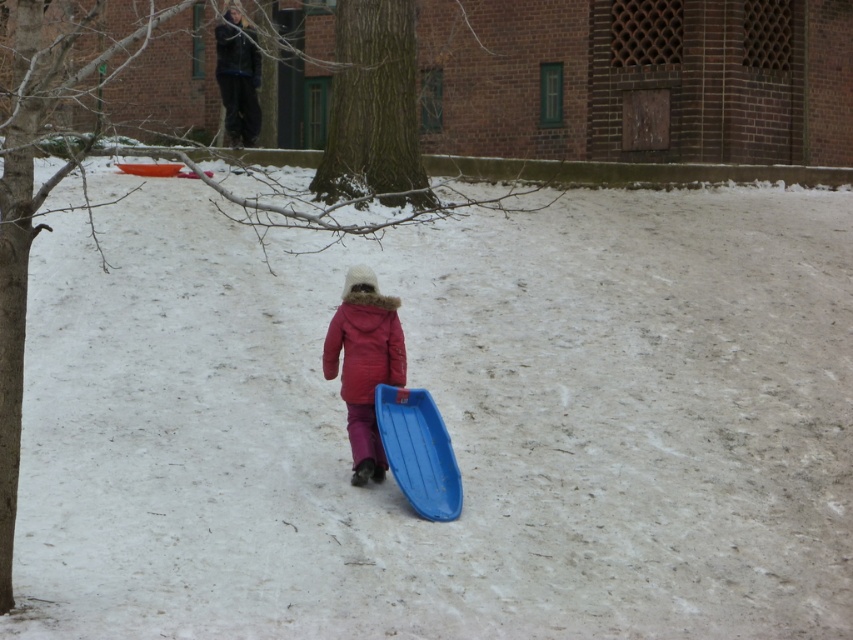
Question: Does matte pink coat at center appear over blue plastic sled at center?

Choices:
 (A) yes
 (B) no

Answer: (A)

Question: Does matte pink coat at center come behind blue plastic sled at center?

Choices:
 (A) yes
 (B) no

Answer: (A)

Question: Among these points, which one is nearest to the camera?

Choices:
 (A) (425, 392)
 (B) (402, 342)

Answer: (A)

Question: Can you confirm if matte pink coat at center is positioned to the right of blue plastic sled at center?

Choices:
 (A) no
 (B) yes

Answer: (A)

Question: Which point is farther to the camera?

Choices:
 (A) [x=389, y=390]
 (B) [x=368, y=285]

Answer: (B)